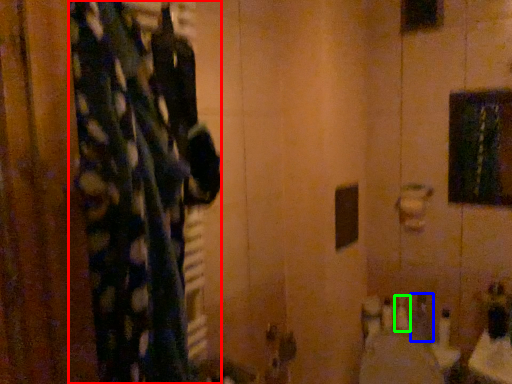
Question: Considering the real-world distances, which object is farthest from curtain (highlighted by a red box)? toiletry (highlighted by a blue box) or toiletry (highlighted by a green box)?

Choices:
 (A) toiletry
 (B) toiletry

Answer: (B)